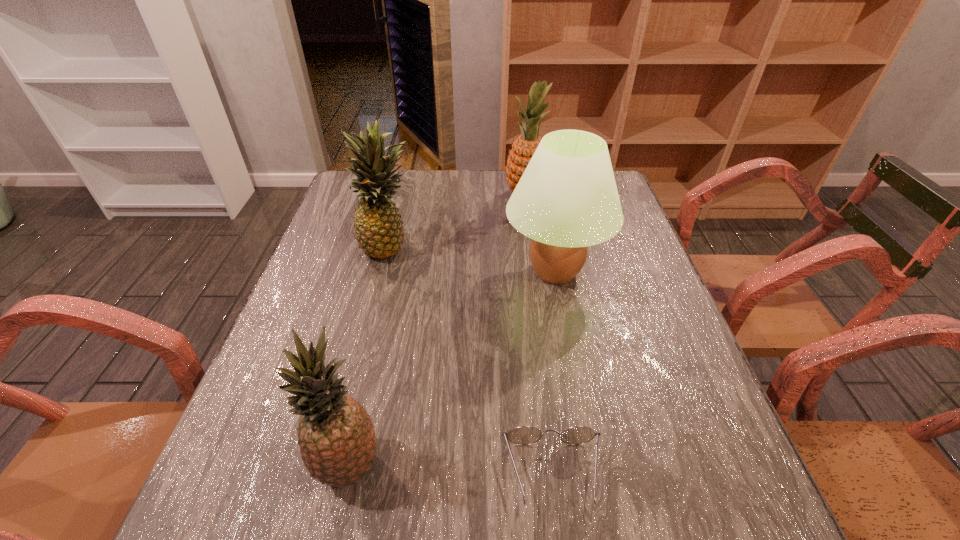
Locate an element on the screen. Image resolution: width=960 pixels, height=540 pixels. vacant space at the right edge of the desktop is located at coordinates (650, 448).

Identify the location of vacant area at the near left corner. The image size is (960, 540). (249, 526).

At what (x,y) coordinates should I click in order to perform the action: click on free space between the nearest pineapple and the second nearest pineapple. Please return your answer as a coordinate pair (x, y). Looking at the image, I should click on (370, 356).

Where is `empty location between the spectacles and the nearest pineapple`? The height and width of the screenshot is (540, 960). empty location between the spectacles and the nearest pineapple is located at coordinates (450, 470).

I want to click on empty space between the spectacles and the lampshade, so click(554, 373).

At what (x,y) coordinates should I click in order to perform the action: click on empty space between the nearest pineapple and the lampshade. Please return your answer as a coordinate pair (x, y). This screenshot has height=540, width=960. Looking at the image, I should click on (452, 369).

This screenshot has width=960, height=540. I want to click on unoccupied position between the shortest object and the second farthest pineapple, so click(x=471, y=361).

Identify the location of free space between the lampshade and the shortest object. (554, 373).

Where is `free area in between the shortest object and the nearest pineapple`? free area in between the shortest object and the nearest pineapple is located at coordinates [450, 470].

Locate an element on the screen. This screenshot has height=540, width=960. free space between the second farthest pineapple and the shortest object is located at coordinates (471, 361).